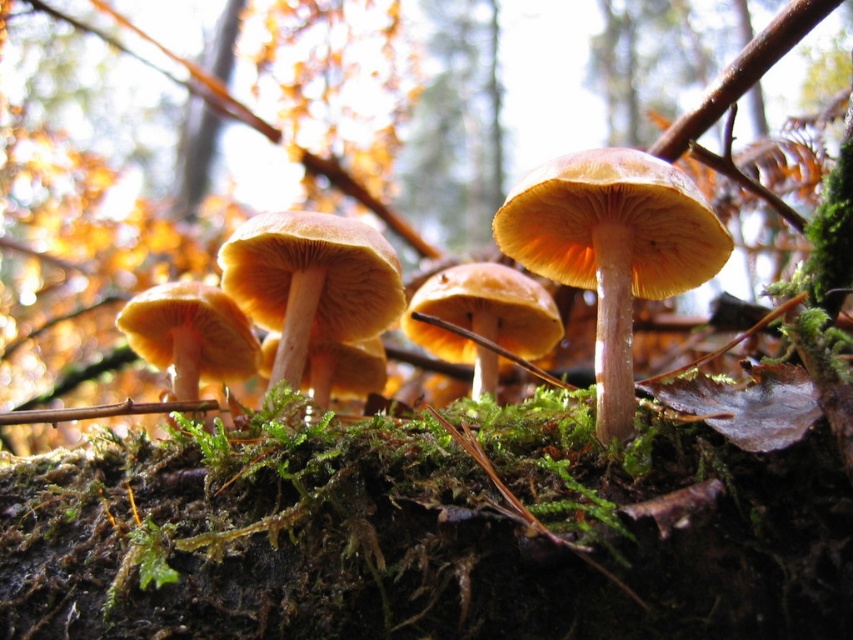
Is shiny orange mushroom at center wider than light brown smooth mushroom at center?

No, shiny orange mushroom at center is not wider than light brown smooth mushroom at center.

Is shiny orange mushroom at center thinner than light brown smooth mushroom at center?

Indeed, shiny orange mushroom at center has a lesser width compared to light brown smooth mushroom at center.

Find the location of `shiny orange mushroom at center`. shiny orange mushroom at center is located at coordinates (612, 250).